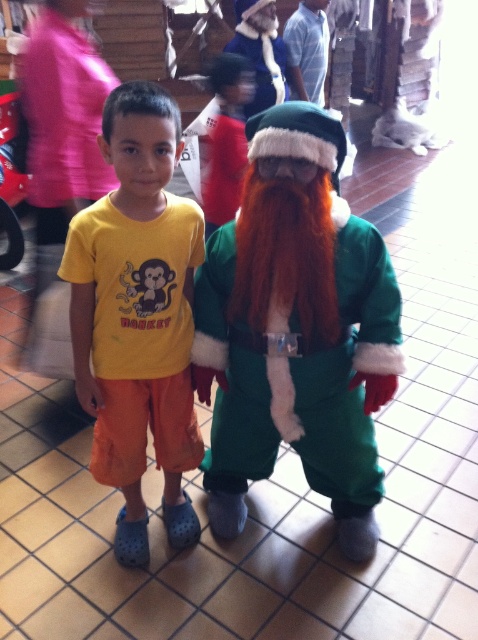
Does green fuzzy santa at center have a lesser width compared to yellow cotton t-shirt at center?

No.

Can you confirm if green fuzzy santa at center is shorter than yellow cotton t-shirt at center?

Correct, green fuzzy santa at center is not as tall as yellow cotton t-shirt at center.

Find the location of a particular element. green fuzzy santa at center is located at coordinates (296, 330).